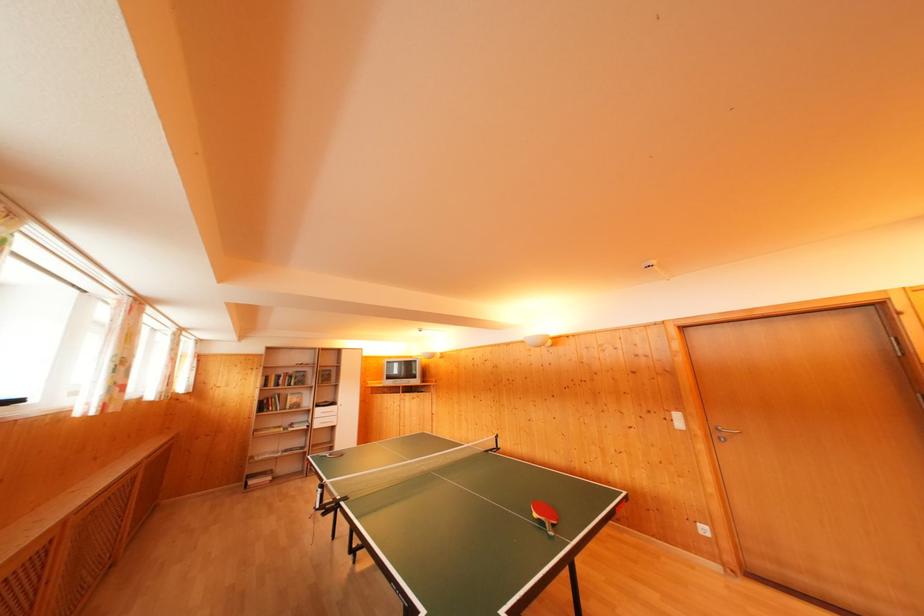
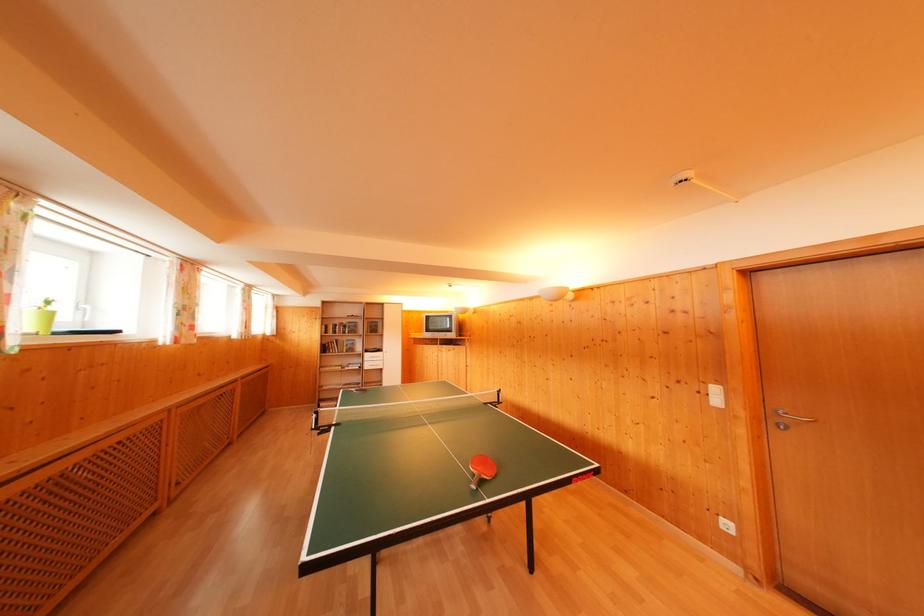
Find the pixel in the second image that matches point 682,421 in the first image.

(721, 395)